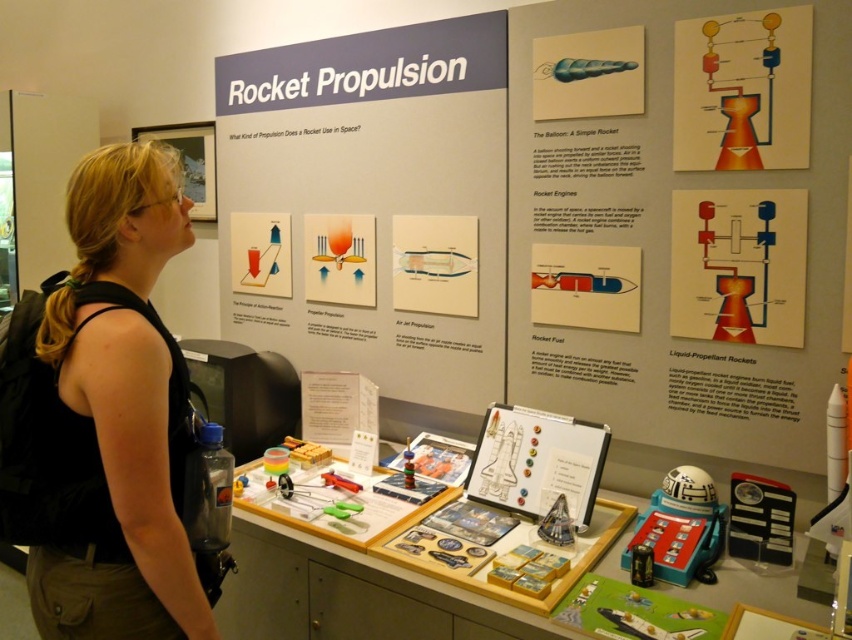
Does black fabric at left have a smaller size compared to matte red rocket engine diagram at center right?

No.

Who is positioned more to the right, black fabric at left or matte red rocket engine diagram at center right?

matte red rocket engine diagram at center right is more to the right.

Locate an element on the screen. The height and width of the screenshot is (640, 852). black fabric at left is located at coordinates (104, 417).

Who is shorter, matte red rocket engine diagram at center right or white matte rocket at lower right?

white matte rocket at lower right

In the scene shown: Between matte red rocket engine diagram at center right and white matte rocket at lower right, which one is positioned higher?

matte red rocket engine diagram at center right is above.

Describe the element at coordinates (738, 266) in the screenshot. I see `matte red rocket engine diagram at center right` at that location.

Find the location of `matte red rocket engine diagram at center right`. matte red rocket engine diagram at center right is located at coordinates (738, 266).

Which is below, black fabric at left or white matte rocket at lower right?

white matte rocket at lower right is lower down.

Does black fabric at left have a greater height compared to white matte rocket at lower right?

Correct, black fabric at left is much taller as white matte rocket at lower right.

Is point (3, 468) positioned in front of point (827, 440)?

Yes, point (3, 468) is in front of point (827, 440).

This screenshot has width=852, height=640. What are the coordinates of `black fabric at left` in the screenshot? It's located at (104, 417).